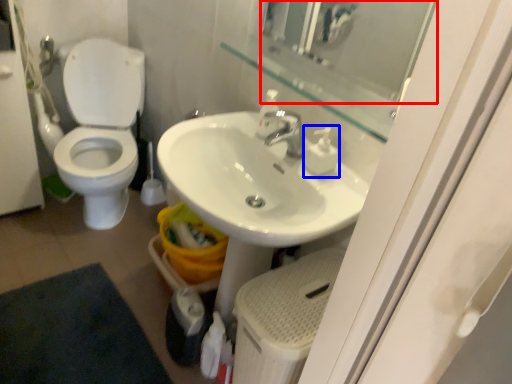
Question: Which object is further to the camera taking this photo, mirror (highlighted by a red box) or soap dispenser (highlighted by a blue box)?

Choices:
 (A) mirror
 (B) soap dispenser

Answer: (B)